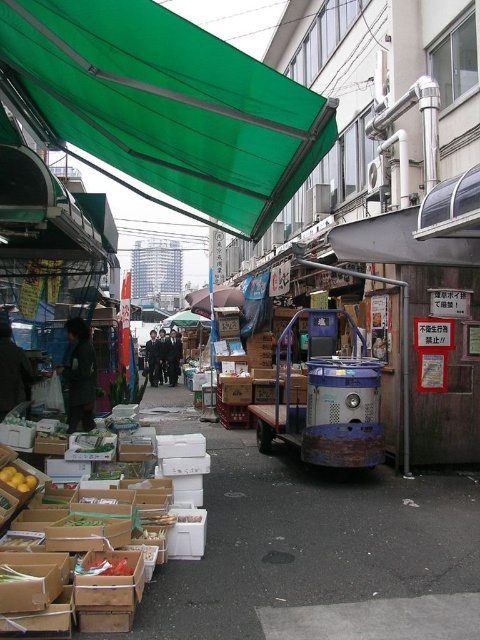
Who is more distant from viewer, (273, 93) or (10, 465)?

Point (10, 465)

Can you confirm if green fabric canopy at upper center is shorter than yellow matte lemons at lower left?

Incorrect, green fabric canopy at upper center's height does not fall short of yellow matte lemons at lower left's.

Describe the element at coordinates (163, 104) in the screenshot. This screenshot has height=640, width=480. I see `green fabric canopy at upper center` at that location.

Locate an element on the screen. Image resolution: width=480 pixels, height=640 pixels. green fabric canopy at upper center is located at coordinates (163, 104).

Which is more to the right, green fabric canopy at upper center or blue metallic cart at center?

Positioned to the right is blue metallic cart at center.

Between point (256, 150) and point (263, 451), which one is positioned in front?

Point (256, 150) is more forward.

The width and height of the screenshot is (480, 640). What are the coordinates of `green fabric canopy at upper center` in the screenshot? It's located at (163, 104).

Can you confirm if blue metallic cart at center is positioned to the right of yellow matte lemons at lower left?

Yes, blue metallic cart at center is to the right of yellow matte lemons at lower left.

Does blue metallic cart at center have a smaller size compared to yellow matte lemons at lower left?

Incorrect, blue metallic cart at center is not smaller in size than yellow matte lemons at lower left.

Identify the location of blue metallic cart at center. Image resolution: width=480 pixels, height=640 pixels. (325, 400).